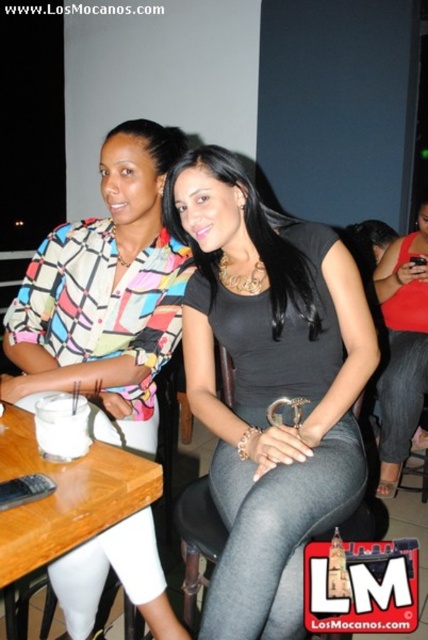
You are a fashion designer who wants to place a new dress on the wooden table at lower left. Given the dimensions of the matte black dress at center, will it fit on the table?

The matte black dress at center is much taller than the wooden table at lower left, so it will not fit on the table.

You are a photographer setting up for a photoshoot. You need to place a prop exactly where the matte black dress at center is currently positioned. According to the coordinates provided, what are the coordinates where you should place the prop?

Result: The coordinates for the matte black dress at center are 0.550 in the x direction and 0.939 in the y direction. So you should place the prop at point (401,352).